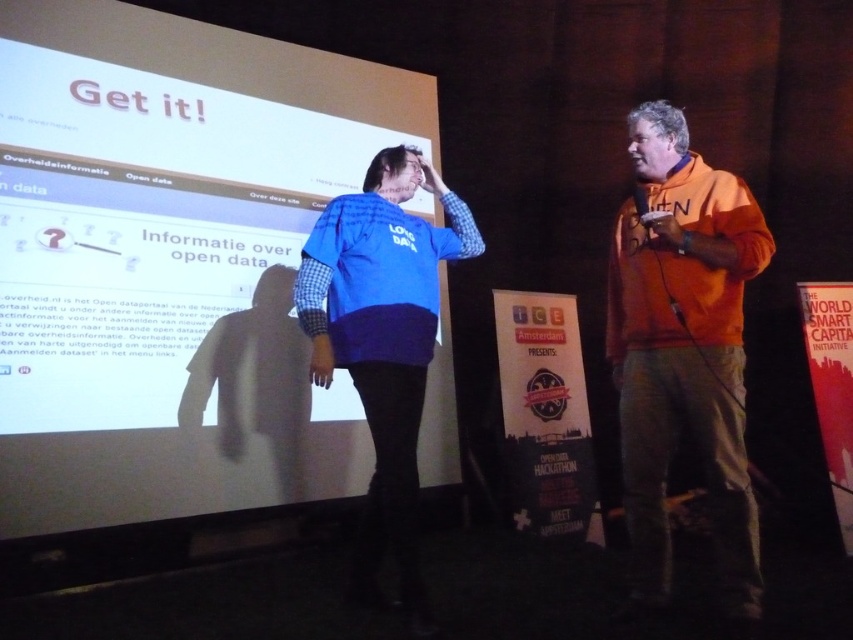
Question: Which point is closer to the camera?

Choices:
 (A) white matte projection screen at upper center
 (B) orange fleece jacket at right

Answer: (B)

Question: Can you confirm if white matte projection screen at upper center is thinner than orange fleece jacket at right?

Choices:
 (A) no
 (B) yes

Answer: (A)

Question: Does white matte projection screen at upper center have a larger size compared to blue fleece jacket at center?

Choices:
 (A) yes
 (B) no

Answer: (A)

Question: Which point is farther to the camera?

Choices:
 (A) blue fleece jacket at center
 (B) white matte projection screen at upper center

Answer: (B)

Question: Among these points, which one is nearest to the camera?

Choices:
 (A) 386,394
 (B) 663,536

Answer: (A)

Question: Is white matte projection screen at upper center to the left of blue fleece jacket at center from the viewer's perspective?

Choices:
 (A) no
 (B) yes

Answer: (B)